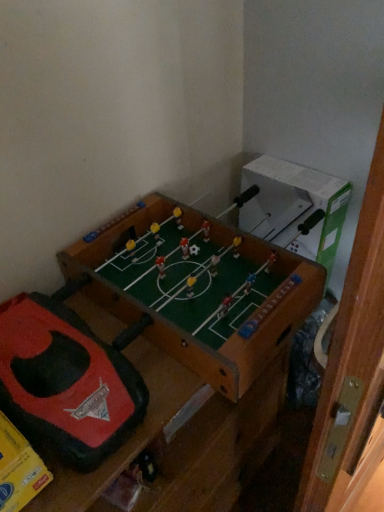
Question: Is the surface of wooden foosball table at center in direct contact with rubberized red and black toy at center?

Choices:
 (A) yes
 (B) no

Answer: (B)

Question: From the image's perspective, is wooden foosball table at center on rubberized red and black toy at center?

Choices:
 (A) no
 (B) yes

Answer: (A)

Question: Considering the relative positions of wooden foosball table at center and rubberized red and black toy at center in the image provided, is wooden foosball table at center to the left of rubberized red and black toy at center from the viewer's perspective?

Choices:
 (A) yes
 (B) no

Answer: (B)

Question: Is rubberized red and black toy at center inside wooden foosball table at center?

Choices:
 (A) yes
 (B) no

Answer: (A)

Question: Is wooden foosball table at center outside of rubberized red and black toy at center?

Choices:
 (A) no
 (B) yes

Answer: (B)

Question: Is there a large distance between wooden foosball table at center and rubberized red and black toy at center?

Choices:
 (A) no
 (B) yes

Answer: (A)

Question: Is rubberized red and black toy at center thinner than wooden foosball table at center?

Choices:
 (A) no
 (B) yes

Answer: (B)

Question: From a real-world perspective, is rubberized red and black toy at center physically above wooden foosball table at center?

Choices:
 (A) yes
 (B) no

Answer: (A)

Question: Is rubberized red and black toy at center facing towards wooden foosball table at center?

Choices:
 (A) yes
 (B) no

Answer: (A)

Question: Considering the relative sizes of rubberized red and black toy at center and wooden foosball table at center in the image provided, is rubberized red and black toy at center shorter than wooden foosball table at center?

Choices:
 (A) yes
 (B) no

Answer: (A)

Question: Does rubberized red and black toy at center have a smaller size compared to wooden foosball table at center?

Choices:
 (A) no
 (B) yes

Answer: (B)

Question: Is rubberized red and black toy at center positioned beyond the bounds of wooden foosball table at center?

Choices:
 (A) no
 (B) yes

Answer: (A)

Question: From the image's perspective, is rubberized red and black toy at center located above or below wooden foosball table at center?

Choices:
 (A) above
 (B) below

Answer: (A)